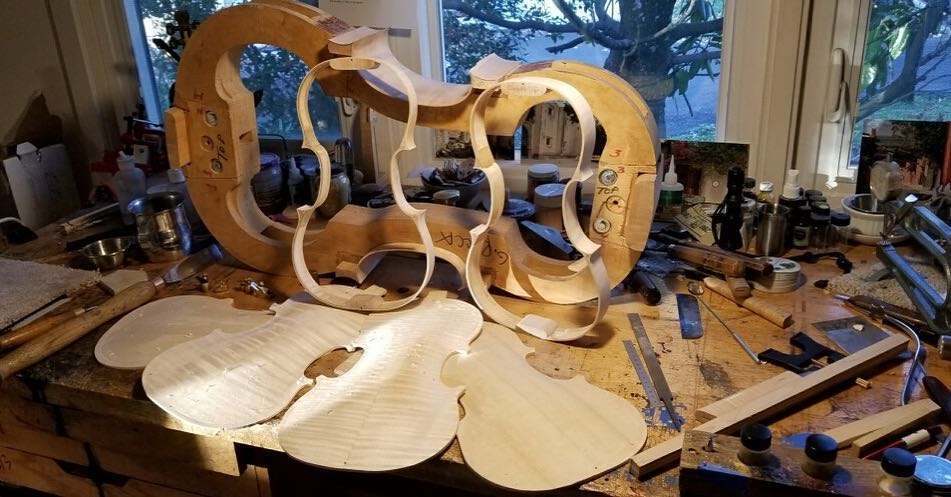
This screenshot has width=951, height=497. I want to click on table, so click(740, 365), click(603, 367), click(558, 358), click(274, 301).